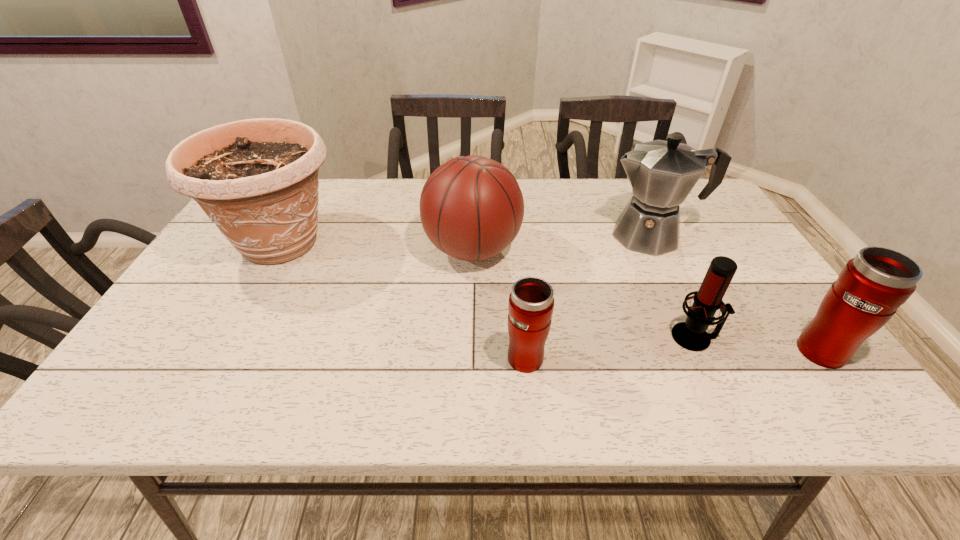
Please point a free position for a thermos bottle on the left. Please provide its 2D coordinates. Your answer should be formatted as a tuple, i.e. [(x, y)], where the tuple contains the x and y coordinates of a point satisfying the conditions above.

[(223, 364)]